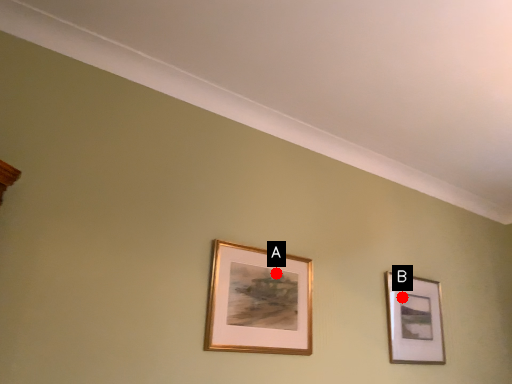
Question: Two points are circled on the image, labeled by A and B beside each circle. Which point is farther from the camera taking this photo?

Choices:
 (A) A is further
 (B) B is further

Answer: (B)